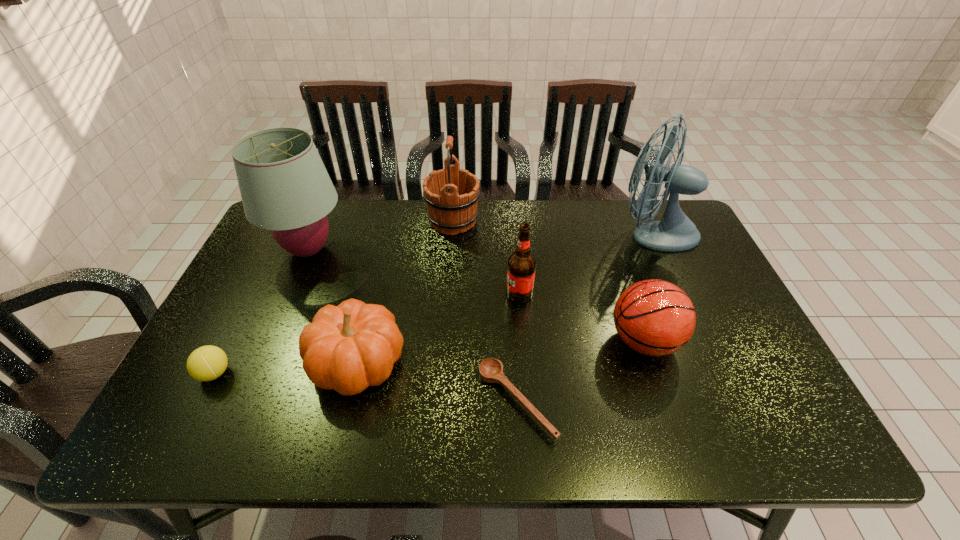
Locate an element on the screen. free region located on the left of the shortest object is located at coordinates (319, 402).

Where is `fan that is at the far edge`? fan that is at the far edge is located at coordinates (675, 232).

The image size is (960, 540). In order to click on lampshade at the far edge in this screenshot , I will do `click(285, 188)`.

At what (x,y) coordinates should I click in order to perform the action: click on wine bucket that is at the far edge. Please return your answer as a coordinate pair (x, y). Looking at the image, I should click on (451, 194).

Find the location of a particular element. The height and width of the screenshot is (540, 960). object located in the near edge section of the desktop is located at coordinates (491, 370).

Locate an element on the screen. The width and height of the screenshot is (960, 540). lampshade present at the left edge is located at coordinates (285, 188).

I want to click on tennis ball located in the left edge section of the desktop, so click(x=206, y=363).

You are a GUI agent. You are given a task and a screenshot of the screen. Output one action in this format:
    pyautogui.click(x=<x>, y=<y>)
    Task: Click on the object that is positioned at the right edge
    
    Given the screenshot: What is the action you would take?
    pyautogui.click(x=675, y=232)

Where is `object positioned at the far left corner`? This screenshot has width=960, height=540. object positioned at the far left corner is located at coordinates (285, 188).

The width and height of the screenshot is (960, 540). In order to click on object that is at the far right corner in this screenshot , I will do `click(675, 232)`.